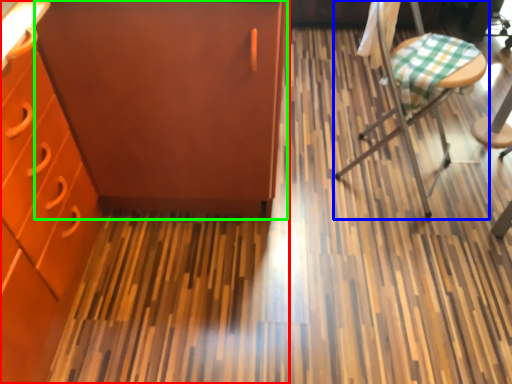
Question: Which is nearer to the cabinetry (highlighted by a red box)? chair (highlighted by a blue box) or file cabinet (highlighted by a green box).

Choices:
 (A) chair
 (B) file cabinet

Answer: (B)